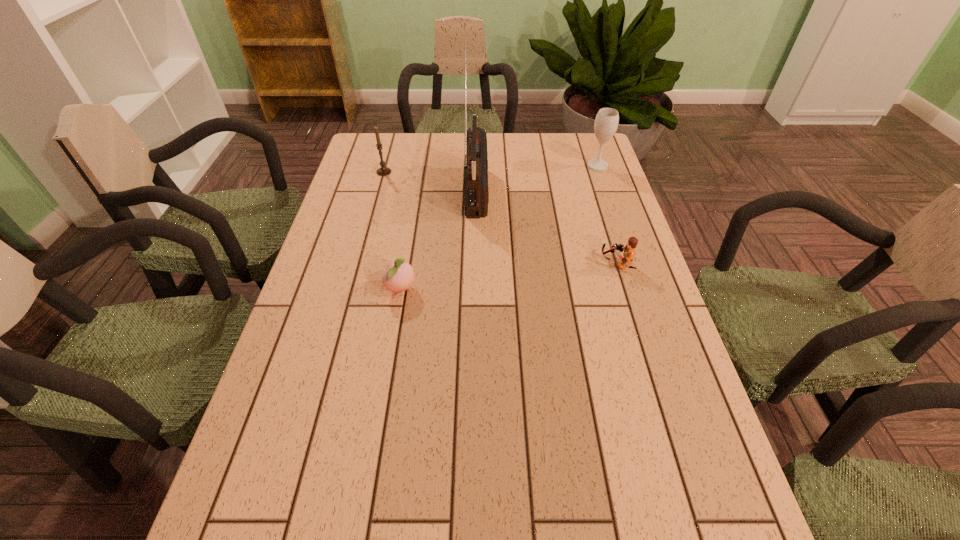
This screenshot has height=540, width=960. In order to click on Lego located in the right edge section of the desktop in this screenshot , I will do [x=629, y=250].

Find the location of a particular element. The image size is (960, 540). object that is positioned at the far left corner is located at coordinates 383,171.

Identify the location of object that is positioned at the far right corner. (606, 122).

Identify the location of free space at the far edge of the desktop. (445, 159).

The height and width of the screenshot is (540, 960). In order to click on vacant region at the left edge of the desktop in this screenshot , I will do pos(357,301).

Locate an element on the screen. vacant area at the right edge is located at coordinates (609, 173).

You are a GUI agent. You are given a task and a screenshot of the screen. Output one action in this format:
    pyautogui.click(x=<x>, y=<y>)
    Task: Click on the empty space between the fourth object from right to left and the Lego
    
    Given the screenshot: What is the action you would take?
    pyautogui.click(x=509, y=276)

What are the coordinates of `free space between the candle and the wineglass` in the screenshot? It's located at (491, 169).

Where is `vacant area that lies between the wineglass and the Lego`? Image resolution: width=960 pixels, height=540 pixels. vacant area that lies between the wineglass and the Lego is located at coordinates (607, 215).

At what (x,y) coordinates should I click in order to perform the action: click on free space between the third object from left to right and the third tallest object. Please return your answer as a coordinate pair (x, y). This screenshot has width=960, height=540. Looking at the image, I should click on (430, 180).